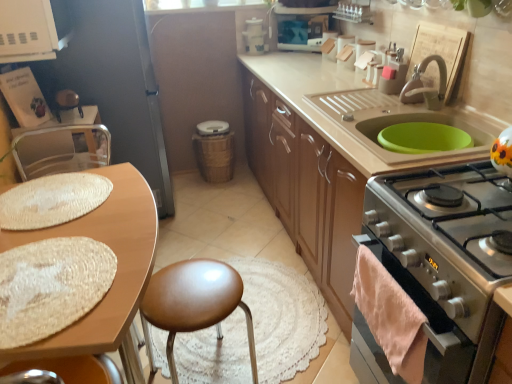
Question: Is woven brown trash can at center, arranged as the second appliance when viewed from the right, a part of white plastic container at upper center, acting as the 2th appliance starting from the left?

Choices:
 (A) yes
 (B) no

Answer: (B)

Question: Does white plastic container at upper center, acting as the 2th appliance starting from the left, appear on the left side of woven brown trash can at center, which appears as the first appliance when viewed from the left?

Choices:
 (A) no
 (B) yes

Answer: (A)

Question: Does white plastic container at upper center, which is counted as the second appliance, starting from the bottom, have a greater height compared to woven brown trash can at center, positioned as the 1th appliance in bottom-to-top order?

Choices:
 (A) no
 (B) yes

Answer: (A)

Question: Is white plastic container at upper center, acting as the 2th appliance starting from the left, closer to camera compared to woven brown trash can at center, positioned as the 1th appliance in bottom-to-top order?

Choices:
 (A) no
 (B) yes

Answer: (B)

Question: Considering the relative positions of white plastic container at upper center, which is counted as the second appliance, starting from the bottom, and woven brown trash can at center, arranged as the second appliance when viewed from the right, in the image provided, is white plastic container at upper center, which is counted as the second appliance, starting from the bottom, behind woven brown trash can at center, arranged as the second appliance when viewed from the right,?

Choices:
 (A) yes
 (B) no

Answer: (B)

Question: Would you say brown leather stool at center is to the left or to the right of matte wood cabinets at center in the picture?

Choices:
 (A) right
 (B) left

Answer: (B)

Question: Is point (172, 306) positioned closer to the camera than point (374, 170)?

Choices:
 (A) farther
 (B) closer

Answer: (A)

Question: Is brown leather stool at center taller or shorter than matte wood cabinets at center?

Choices:
 (A) short
 (B) tall

Answer: (A)

Question: Is brown leather stool at center wider or thinner than matte wood cabinets at center?

Choices:
 (A) wide
 (B) thin

Answer: (B)

Question: Is matte wood cabinets at center taller or shorter than green rubber mat at upper right?

Choices:
 (A) tall
 (B) short

Answer: (A)

Question: Looking at their shapes, would you say matte wood cabinets at center is wider or thinner than green rubber mat at upper right?

Choices:
 (A) thin
 (B) wide

Answer: (B)

Question: Looking at the image, does matte wood cabinets at center seem bigger or smaller compared to green rubber mat at upper right?

Choices:
 (A) small
 (B) big

Answer: (B)

Question: Considering the relative positions of matte wood cabinets at center and green rubber mat at upper right in the image provided, is matte wood cabinets at center to the left or to the right of green rubber mat at upper right?

Choices:
 (A) left
 (B) right

Answer: (A)

Question: Would you say green rubber mat at upper right is inside or outside metallic silver chair at left?

Choices:
 (A) inside
 (B) outside

Answer: (B)

Question: From a real-world perspective, is green rubber mat at upper right positioned above or below metallic silver chair at left?

Choices:
 (A) below
 (B) above

Answer: (B)